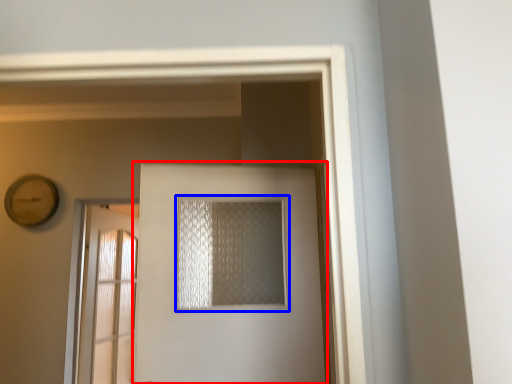
Question: Which point is further to the camera, door (highlighted by a red box) or window (highlighted by a blue box)?

Choices:
 (A) door
 (B) window

Answer: (B)